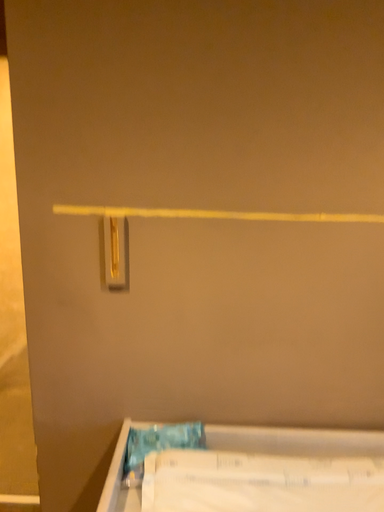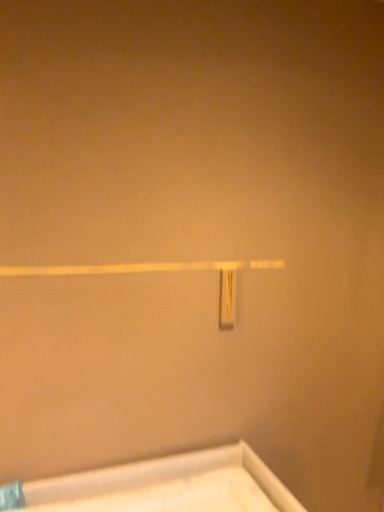
Question: Which way did the camera rotate in the video?

Choices:
 (A) rotated upward
 (B) rotated downward

Answer: (A)